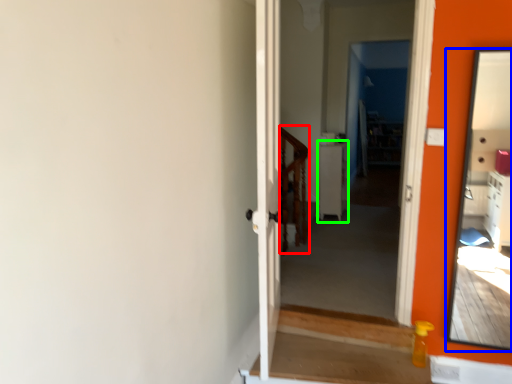
Question: Estimate the real-world distances between objects in this image. Which object is closer to balustrade (highlighted by a red box), mirror (highlighted by a blue box) or table (highlighted by a green box)?

Choices:
 (A) mirror
 (B) table

Answer: (B)